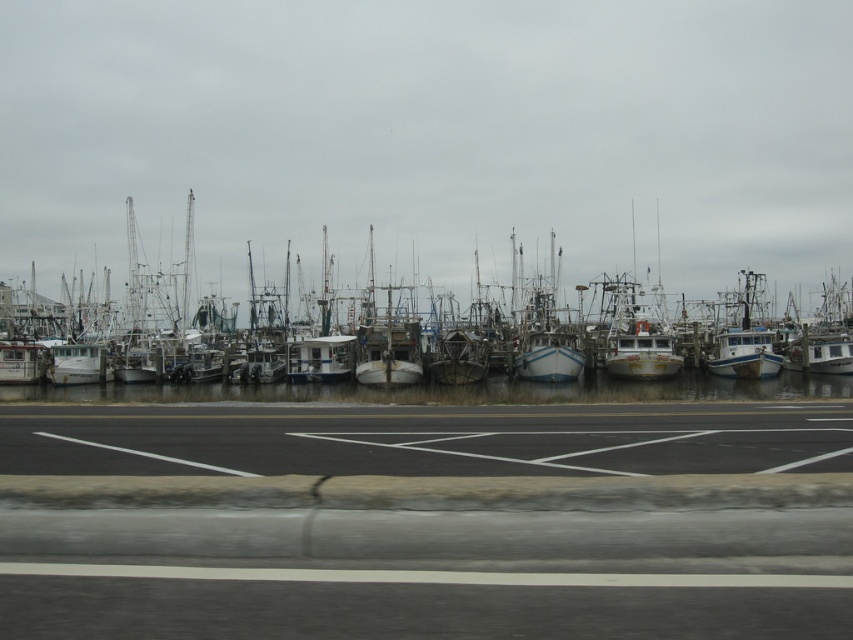
Between point (497, 449) and point (207, 380), which one is positioned in front?

Point (497, 449) is more forward.

Does point (343, 486) lie behind point (3, 308)?

No, (343, 486) is in front of (3, 308).

This screenshot has width=853, height=640. In order to click on black asphalt parking lot at center in this screenshot , I will do point(427,522).